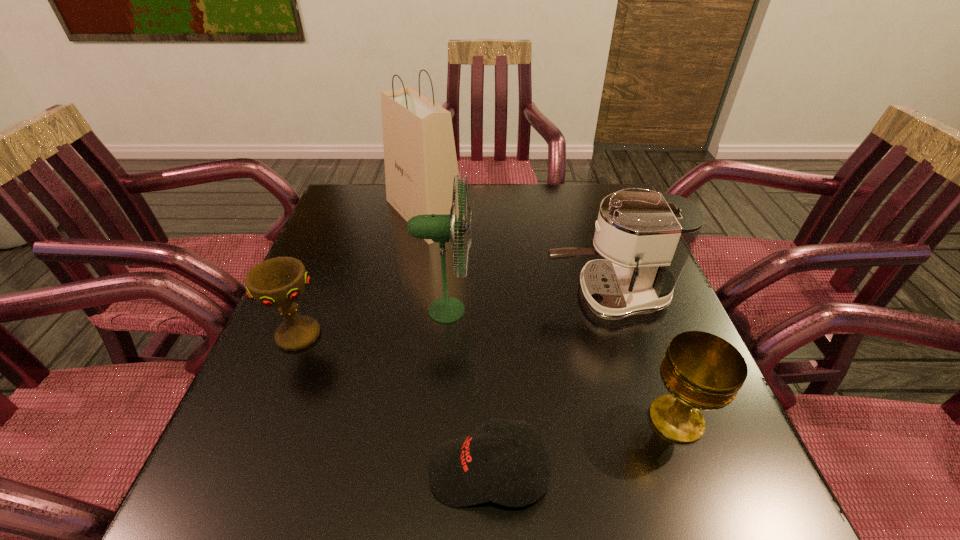
Locate an element on the screen. free point located on the front-facing side of the third tallest object is located at coordinates (518, 296).

The image size is (960, 540). Find the location of `vacant region located 0.310m on the front-facing side of the third tallest object`. vacant region located 0.310m on the front-facing side of the third tallest object is located at coordinates (412, 296).

Identify the location of vacant area situated 0.130m on the front-facing side of the third tallest object. (489, 296).

The image size is (960, 540). Identify the location of free space located on the back of the leftmost object. (337, 242).

Find the location of a particular element. This screenshot has width=960, height=540. vacant space located on the left of the nearer chalice is located at coordinates (550, 419).

Locate an element on the screen. Image resolution: width=960 pixels, height=540 pixels. free space located 0.200m on the front-facing side of the baseball cap is located at coordinates (307, 472).

Find the location of `vacant space located on the front-facing side of the baseball cap`. vacant space located on the front-facing side of the baseball cap is located at coordinates (283, 472).

Locate an element on the screen. The height and width of the screenshot is (540, 960). vacant region located 0.200m on the front-facing side of the baseball cap is located at coordinates (307, 472).

You are a GUI agent. You are given a task and a screenshot of the screen. Output one action in this format:
    pyautogui.click(x=<x>, y=<y>)
    Task: Click on the object that is positioned at the far edge
    This screenshot has height=540, width=960.
    Given the screenshot: What is the action you would take?
    420,159

The height and width of the screenshot is (540, 960). In order to click on object that is at the near edge in this screenshot , I will do `click(459, 475)`.